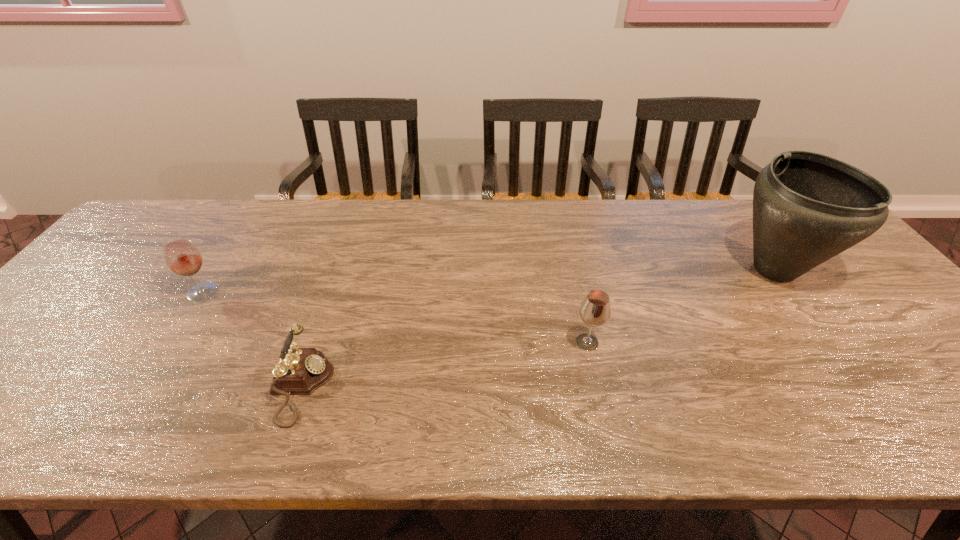
This screenshot has width=960, height=540. Find the location of `the tallest object`. the tallest object is located at coordinates (807, 207).

Where is `the rightmost object`? the rightmost object is located at coordinates (807, 207).

Locate an element on the screen. The width and height of the screenshot is (960, 540). the left wineglass is located at coordinates (182, 257).

Where is `the leftmost object`? The width and height of the screenshot is (960, 540). the leftmost object is located at coordinates click(182, 257).

Identify the location of the third object from left to right. This screenshot has width=960, height=540. (595, 310).

The width and height of the screenshot is (960, 540). Identify the location of the right wineglass. (595, 310).

The height and width of the screenshot is (540, 960). Identify the location of the shortest object. (300, 371).

This screenshot has width=960, height=540. In order to click on the third object from right to left in this screenshot , I will do `click(300, 371)`.

Find the location of a particular element. The image size is (960, 540). free space located on the front of the urn is located at coordinates (828, 344).

Where is `free region located 0.360m on the front of the left wineglass`? The height and width of the screenshot is (540, 960). free region located 0.360m on the front of the left wineglass is located at coordinates (110, 435).